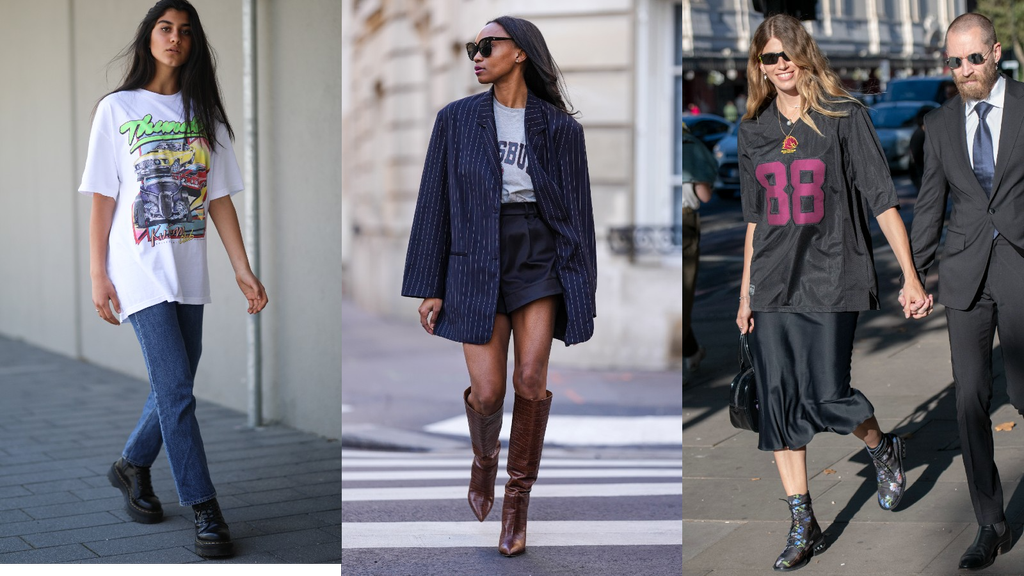
Where is `wall`? This screenshot has height=576, width=1024. wall is located at coordinates (594, 88), (374, 145).